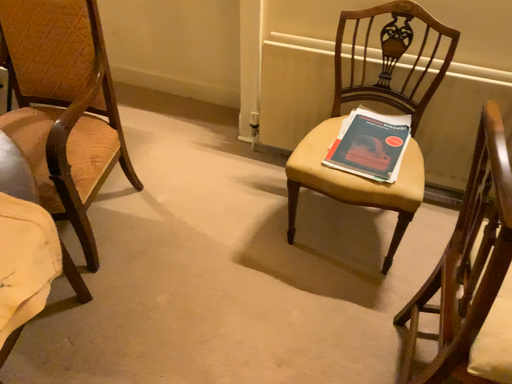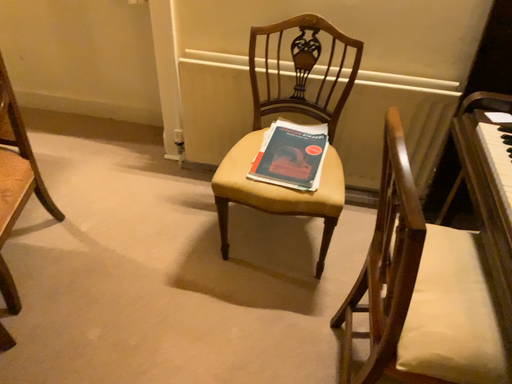
Question: How did the camera likely rotate when shooting the video?

Choices:
 (A) rotated left
 (B) rotated right

Answer: (B)